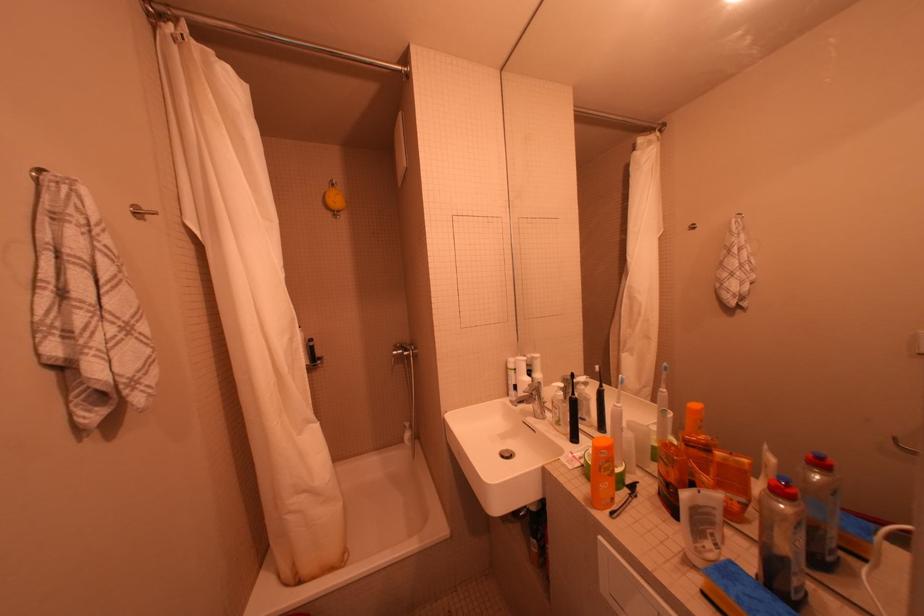
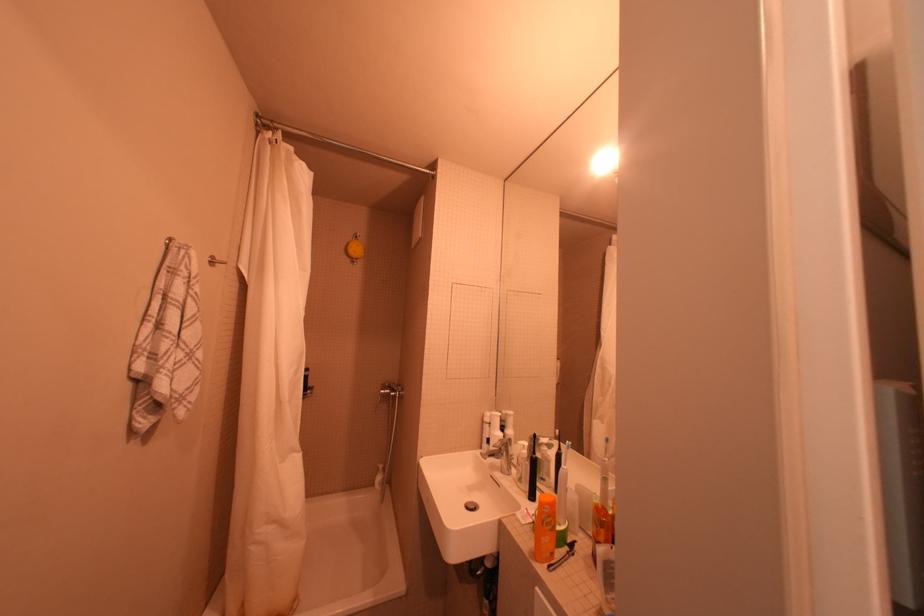
The point at (x=403, y=354) is marked in the first image. Where is the corresponding point in the second image?

(391, 392)